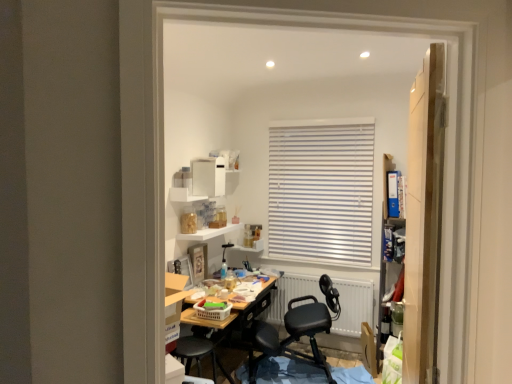
Find the location of `free point above plastic laundry basket at center (from a real-world perspective)`. free point above plastic laundry basket at center (from a real-world perspective) is located at coordinates (204, 300).